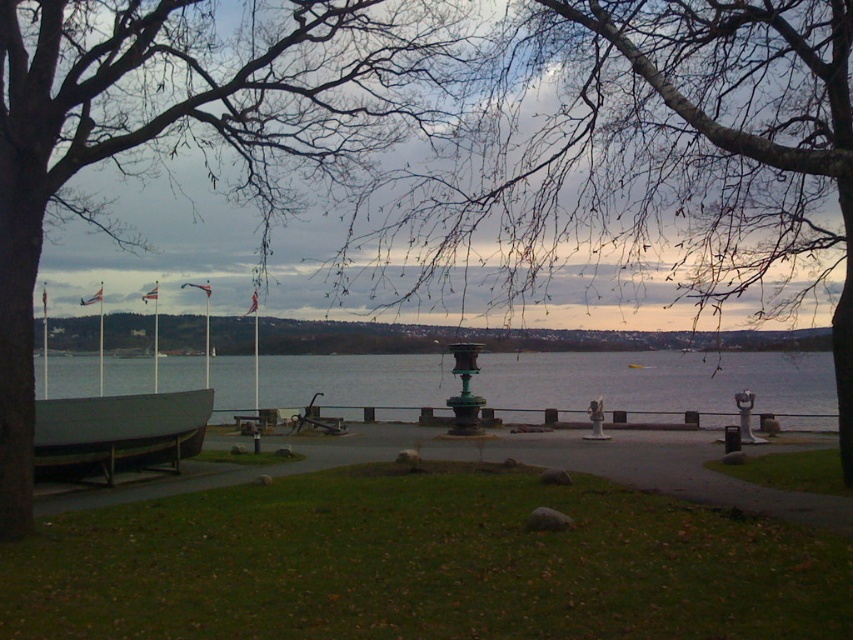
Based on the scene description, what object is located at the coordinates point (194, 124)?

The dark brown bark tree at left is located at point (194, 124).

You are an environmental scientist assessing the ecological balance of the lakeside area. You need to determine which object occupies a larger horizontal space in the scene for your report. Which one is wider between the dark brown bark tree at left and the clear water at center?

The clear water at center is wider than the dark brown bark tree at left, as the dark brown bark tree at left has a smaller width compared to the clear water at center according to the description.